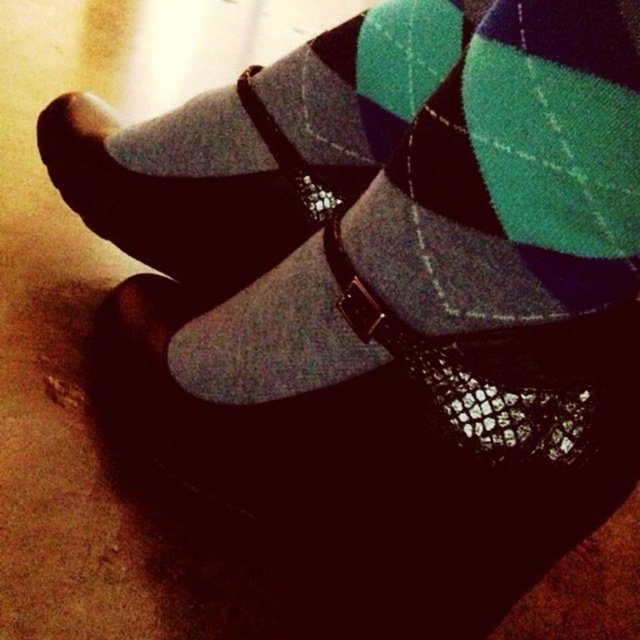
You are trying to match a pair of socks for a formal event. You have an argyle wool sock at center and a matte black socks at center. Which sock would you choose to ensure a better fit with your shoes?

The argyle wool sock at center is larger in size than the matte black socks at center, so the matte black socks at center would provide a better fit with your shoes.

You are trying to pair your socks for an upcoming event. You have an argyle wool sock at center and a matte black socks at center. Which sock is located to the right when looking at both socks together?

The argyle wool sock at center is positioned on the right side of matte black socks at center, so it is the sock located to the right.